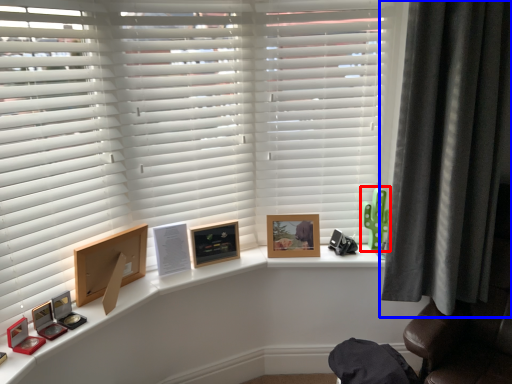
Question: Which point is further to the camera, toy (highlighted by a red box) or curtain (highlighted by a blue box)?

Choices:
 (A) toy
 (B) curtain

Answer: (A)